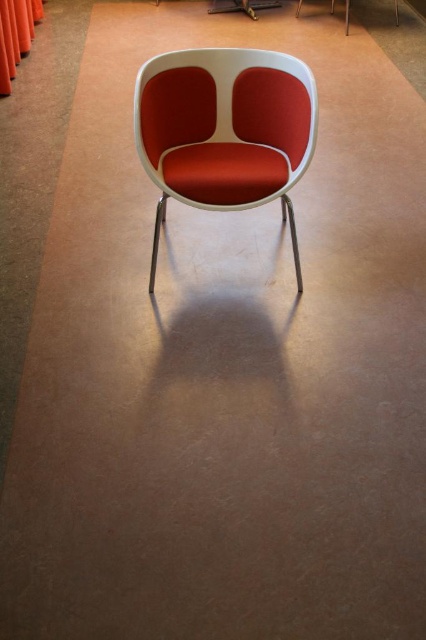
Locate an element on the screen. matte red fabric chair at center is located at coordinates (224, 131).

Between matte red fabric chair at center and orange fabric curtain at left, which one is positioned lower?

matte red fabric chair at center is lower down.

Is point (172, 147) less distant than point (5, 88)?

Yes, point (172, 147) is closer to viewer.

Where is `matte red fabric chair at center`? This screenshot has height=640, width=426. matte red fabric chair at center is located at coordinates (224, 131).